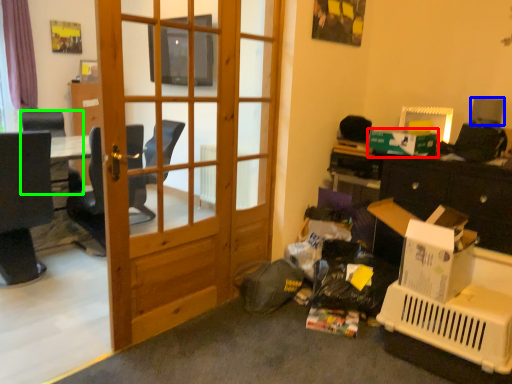
Question: Which is nearer to the box (highlighted by a red box)? loudspeaker (highlighted by a blue box) or chair (highlighted by a green box).

Choices:
 (A) loudspeaker
 (B) chair

Answer: (A)